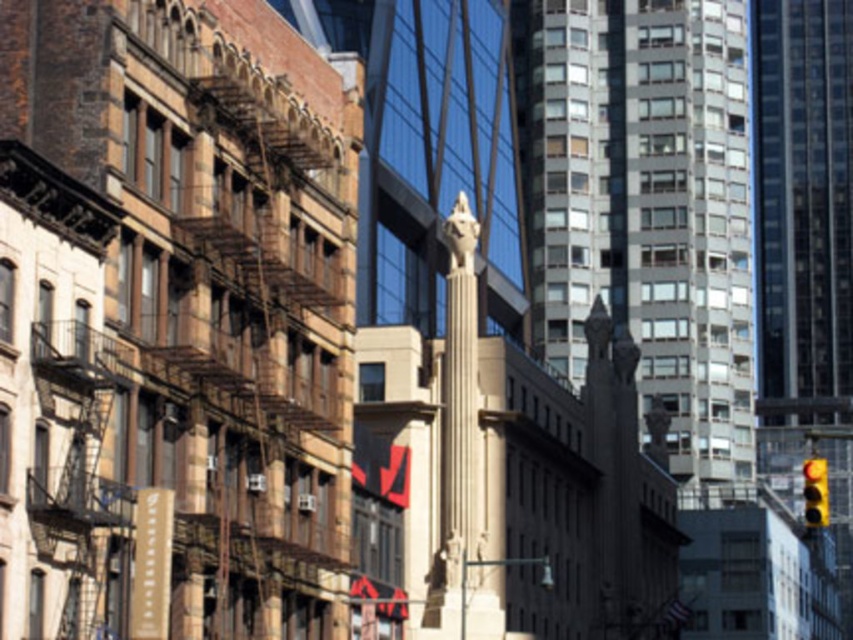
Is glassy reflective tower at right to the right of yellow matte traffic light at lower right from the viewer's perspective?

Yes, glassy reflective tower at right is to the right of yellow matte traffic light at lower right.

Is glassy reflective tower at right smaller than yellow matte traffic light at lower right?

No.

At what (x,y) coordinates should I click in order to perform the action: click on glassy reflective tower at right. Please return your answer as a coordinate pair (x, y). Looking at the image, I should click on (801, 221).

The height and width of the screenshot is (640, 853). In order to click on glassy reflective tower at right in this screenshot , I will do (x=801, y=221).

Does gray glass tower at center appear on the left side of yellow matte traffic light at lower right?

Correct, you'll find gray glass tower at center to the left of yellow matte traffic light at lower right.

At what (x,y) coordinates should I click in order to perform the action: click on gray glass tower at center. Please return your answer as a coordinate pair (x, y). Looking at the image, I should click on (646, 209).

The width and height of the screenshot is (853, 640). What do you see at coordinates (646, 209) in the screenshot?
I see `gray glass tower at center` at bounding box center [646, 209].

The image size is (853, 640). Find the location of `gray glass tower at center`. gray glass tower at center is located at coordinates (646, 209).

Does gray glass tower at center have a larger size compared to glassy reflective tower at right?

Incorrect, gray glass tower at center is not larger than glassy reflective tower at right.

Is gray glass tower at center below glassy reflective tower at right?

Yes.

Which is behind, point (659, 266) or point (833, 412)?

Positioned behind is point (833, 412).

Locate an element on the screen. gray glass tower at center is located at coordinates (646, 209).